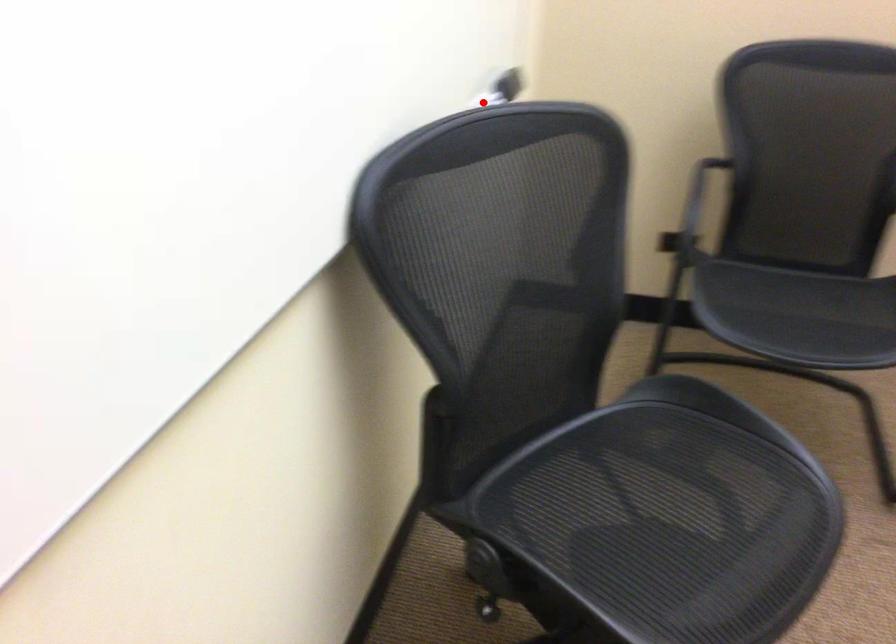
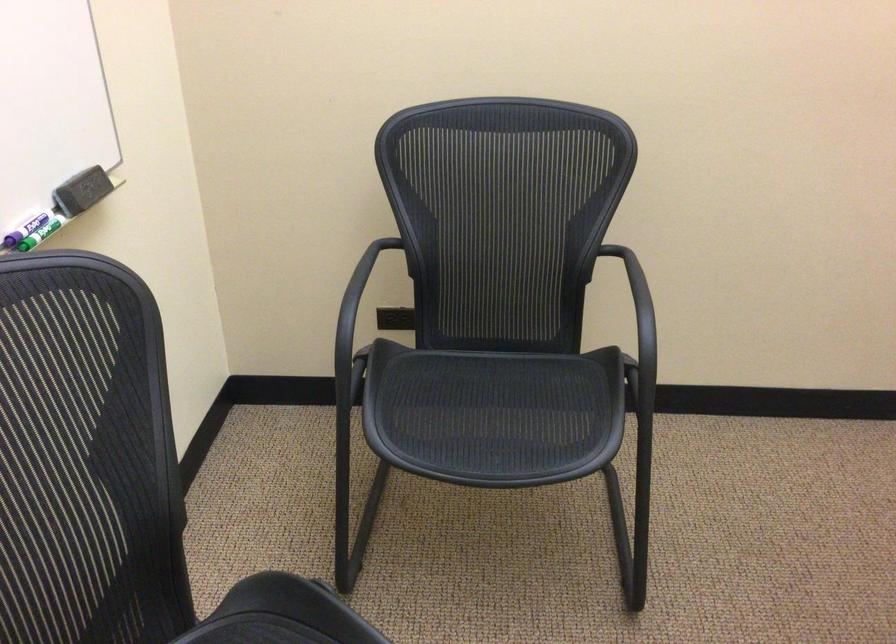
Where in the second image is the point corresponding to the highlighted location from the first image?

(41, 232)